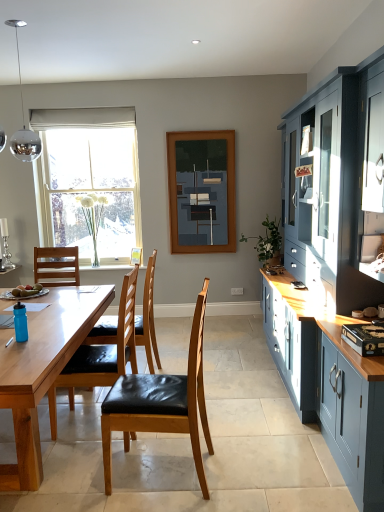
Question: Would you say brown leather chair at center, which is counted as the 1th chair, starting from the back, is to the left or to the right of dark blue matte painting at center in the picture?

Choices:
 (A) left
 (B) right

Answer: (A)

Question: In the image, is brown leather chair at center, the third chair from the front, positioned in front of or behind dark blue matte painting at center?

Choices:
 (A) behind
 (B) front

Answer: (B)

Question: Which object is positioned closest to the brown leather chair at center, the third chair from the front?

Choices:
 (A) wooden picture frame at center
 (B) matte black plate at table left
 (C) white plastic power outlet at lower center
 (D) dark blue matte painting at center
 (E) white fabric curtain at upper center

Answer: (B)

Question: Based on their relative distances, which object is farther from the wooden chair with black leather seat at left, which is the 2th chair in back-to-front order?

Choices:
 (A) polished chrome globe at upper left
 (B) wooden picture frame at center
 (C) blue plastic power plugs and sockets at lower left
 (D) teal matte water bottle at table left
 (E) brown leather chair at center, which is counted as the 1th chair, starting from the back

Answer: (A)